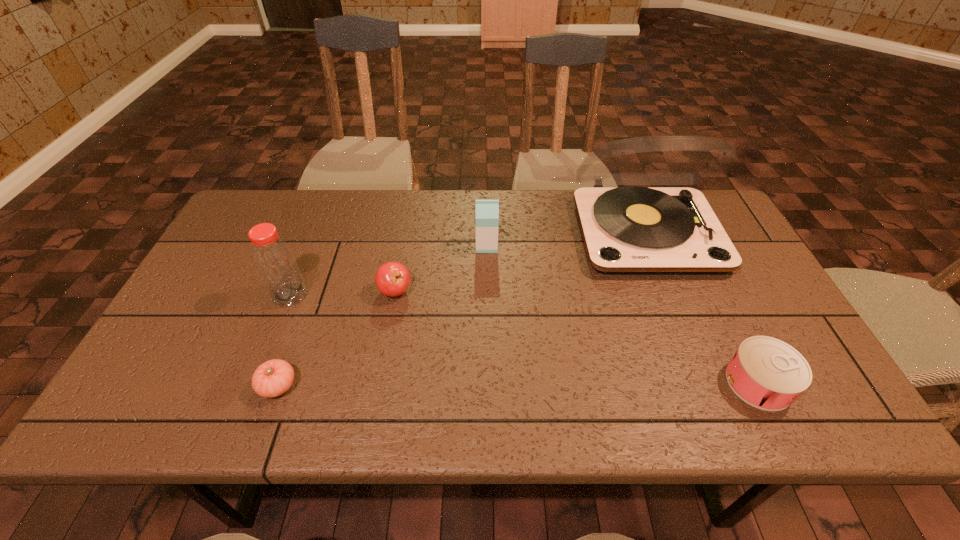
Where is `vacant space at the far edge`? vacant space at the far edge is located at coordinates (328, 209).

The height and width of the screenshot is (540, 960). I want to click on vacant region at the near edge of the desktop, so click(x=674, y=407).

Find the location of a particular element. The width and height of the screenshot is (960, 540). vacant space at the left edge is located at coordinates coord(229,264).

Where is `blank area at the right edge`? blank area at the right edge is located at coordinates pos(819,372).

Locate an element on the screen. Image resolution: width=960 pixels, height=540 pixels. empty location between the fourth object from right to left and the can is located at coordinates (577, 336).

Image resolution: width=960 pixels, height=540 pixels. Identify the location of vacant space that's between the shortest object and the third tallest object. (382, 315).

Where is `free area in between the can and the bottle`? free area in between the can and the bottle is located at coordinates (524, 339).

Where is `vacant space in between the second tallest object and the can`? The image size is (960, 540). vacant space in between the second tallest object and the can is located at coordinates (524, 339).

Image resolution: width=960 pixels, height=540 pixels. Find the location of `empty space that is in between the fourth object from right to left and the can`. empty space that is in between the fourth object from right to left and the can is located at coordinates (x=577, y=336).

Where is `free space between the record player and the third tallest object`? free space between the record player and the third tallest object is located at coordinates (566, 239).